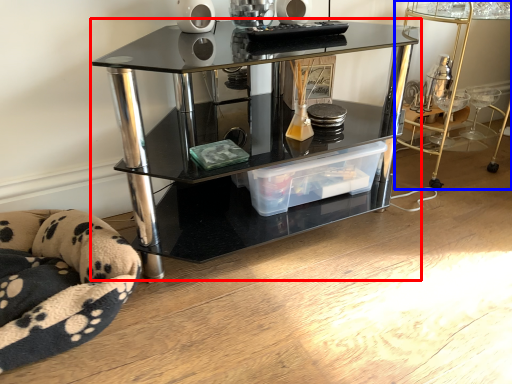
Question: Which object appears closest to the camera in this image, shelf (highlighted by a red box) or table (highlighted by a blue box)?

Choices:
 (A) shelf
 (B) table

Answer: (A)